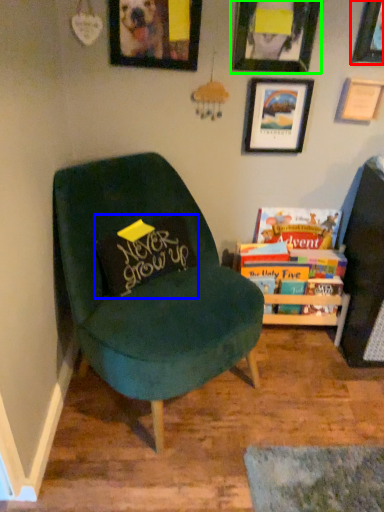
Question: Estimate the real-world distances between objects in this image. Which object is closer to picture frame (highlighted by a red box), pillow (highlighted by a blue box) or picture frame (highlighted by a green box)?

Choices:
 (A) pillow
 (B) picture frame

Answer: (B)